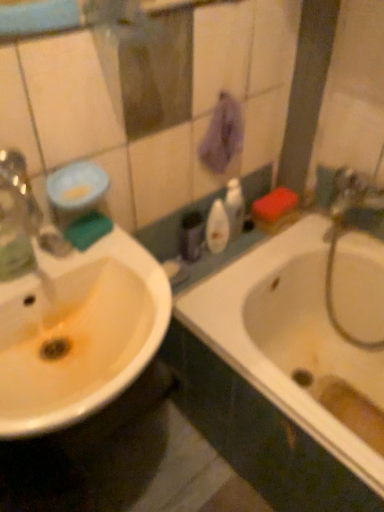
I want to click on free space in front of green sponge at left, so click(64, 270).